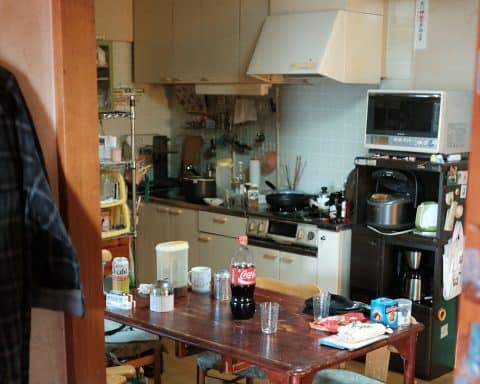
Locate an element on the screen. front of stove is located at coordinates (297, 233).